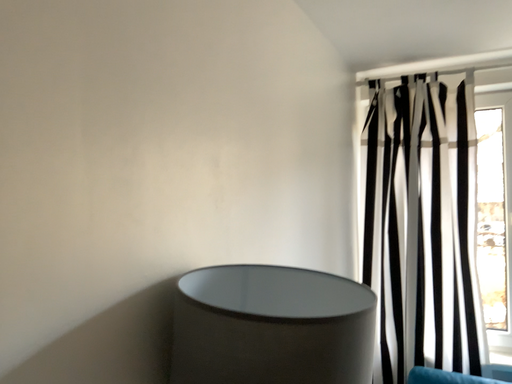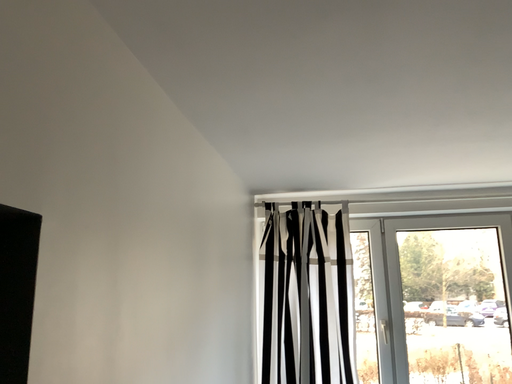
Question: Which way did the camera rotate in the video?

Choices:
 (A) rotated right
 (B) rotated left

Answer: (A)